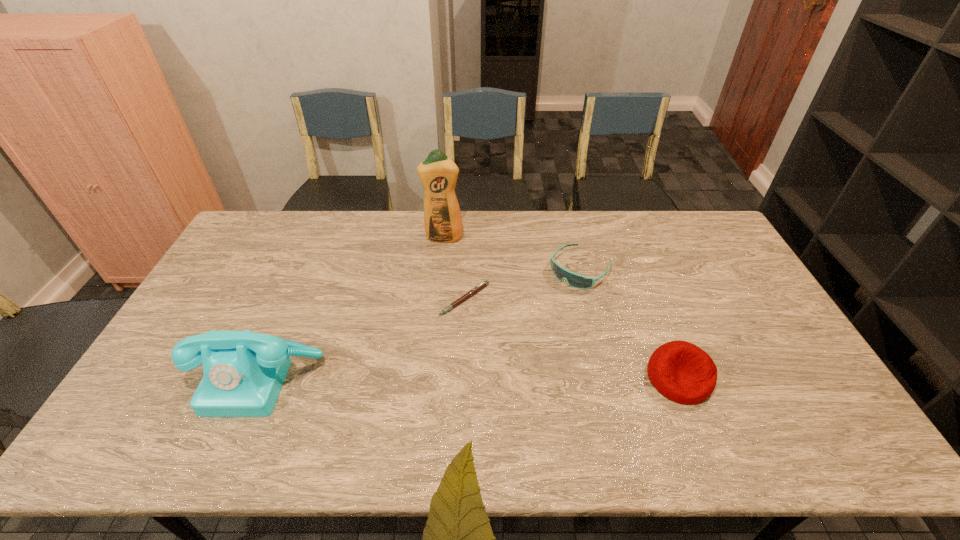
The height and width of the screenshot is (540, 960). What are the coordinates of `free space on the desktop that is between the leftmost object and the rightmost object and is positioned at the nib of the shortest object` in the screenshot? It's located at (484, 378).

At what (x,y) coordinates should I click in order to perform the action: click on vacant space on the desktop that is between the leftmost object and the beanbag and is positioned on the front-facing side of the sunglasses. Please return your answer as a coordinate pair (x, y). This screenshot has height=540, width=960. Looking at the image, I should click on (468, 378).

Locate an element on the screen. Image resolution: width=960 pixels, height=540 pixels. vacant space on the desktop that is between the telephone and the third tallest object and is positioned on the label of the detergent is located at coordinates (440, 378).